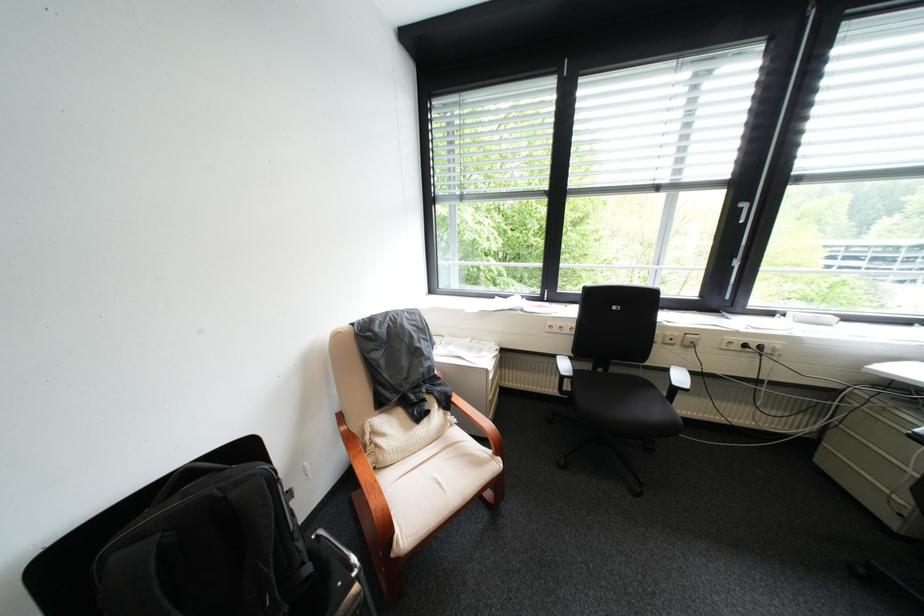
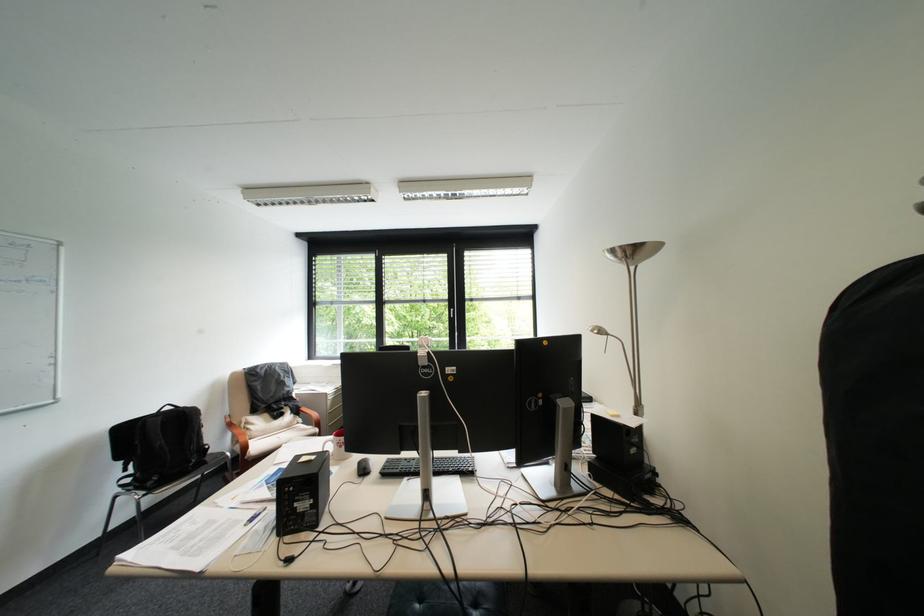
The point at (380,437) is marked in the first image. Where is the corresponding point in the second image?

(256, 424)